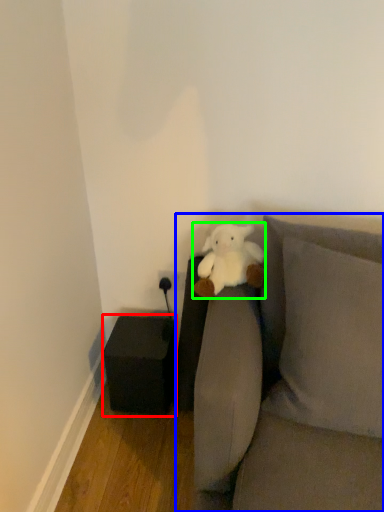
Question: Which object is positioned closest to furniture (highlighted by a red box)? Select from studio couch (highlighted by a blue box) and teddy bear (highlighted by a green box).

Choices:
 (A) studio couch
 (B) teddy bear

Answer: (B)